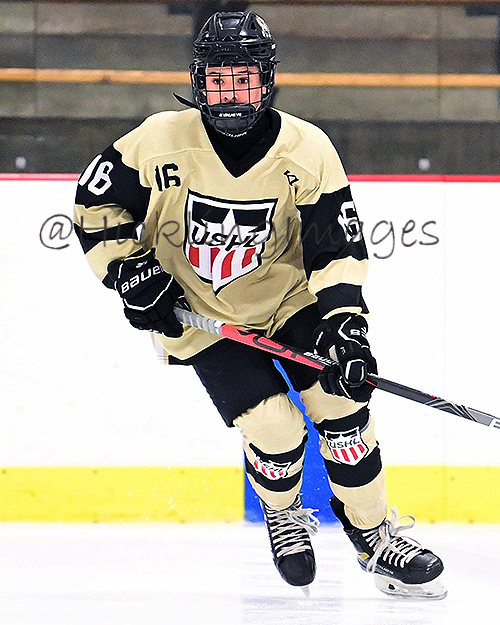
Where is `white wall`? white wall is located at coordinates (66, 317), (440, 330).